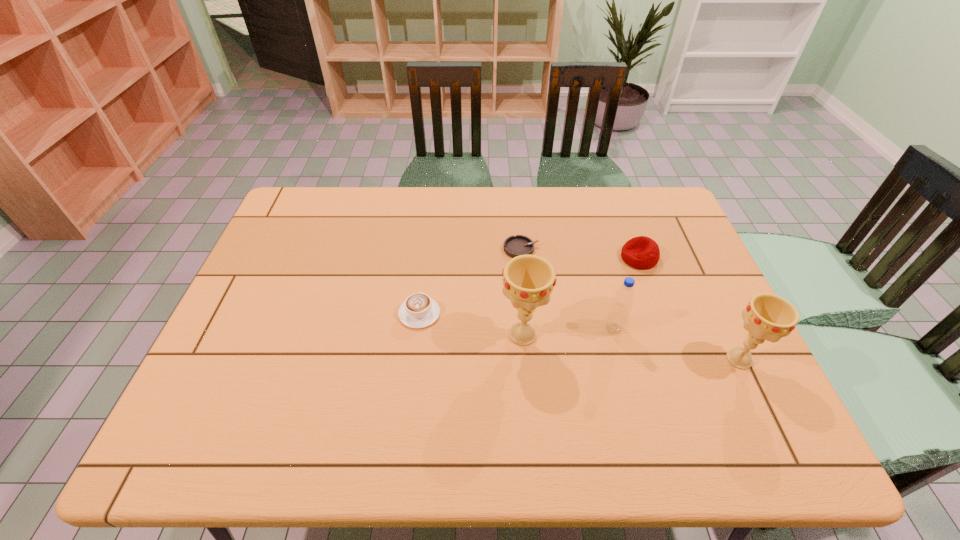
I want to click on blank space that satisfies the following two spatial constraints: 1. on the front side of the shortest object; 2. on the right side of the shorter chalice, so click(x=532, y=359).

Identify the location of vacant area in the image that satisfies the following two spatial constraints: 1. on the seat area of the third shortest object; 2. on the front side of the water bottle. The height and width of the screenshot is (540, 960). (664, 328).